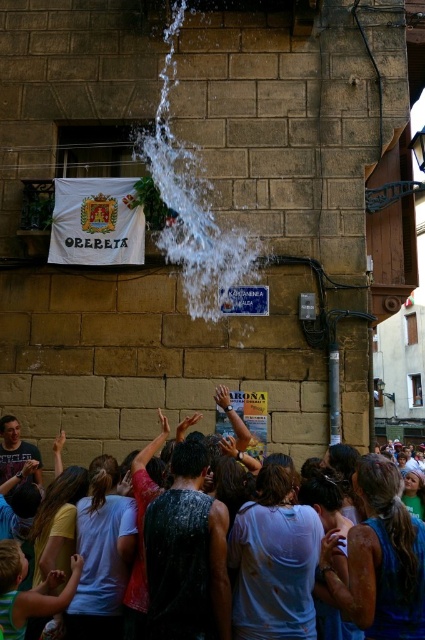
Between white frothy water at center and wet skin crowd at lower center, which one is positioned higher?

white frothy water at center is above.

Between white frothy water at center and wet skin crowd at lower center, which one is positioned lower?

wet skin crowd at lower center is below.

In order to click on white frothy water at center in this screenshot , I will do `click(192, 202)`.

What are the coordinates of `white frothy water at center` in the screenshot? It's located at (192, 202).